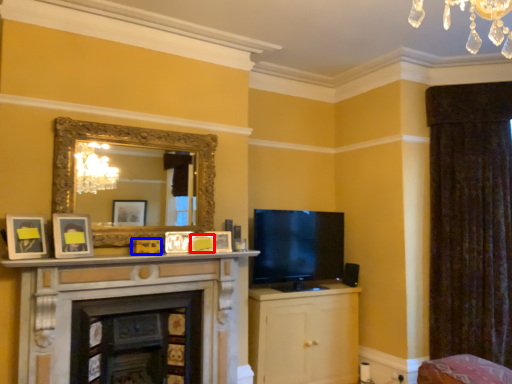
Question: Which point is further to the camera, picture frame (highlighted by a red box) or picture frame (highlighted by a blue box)?

Choices:
 (A) picture frame
 (B) picture frame

Answer: (A)